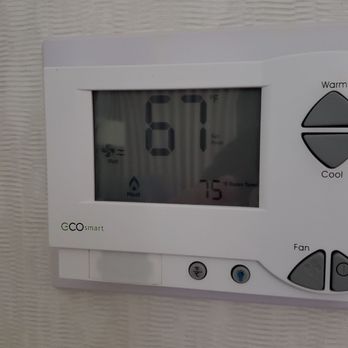
At what (x,y) coordinates should I click in order to perform the action: click on control button. Please return your answer as a coordinate pair (x, y). The width and height of the screenshot is (348, 348). Looking at the image, I should click on (197, 272), (239, 270), (308, 265), (336, 265), (328, 151), (332, 116).